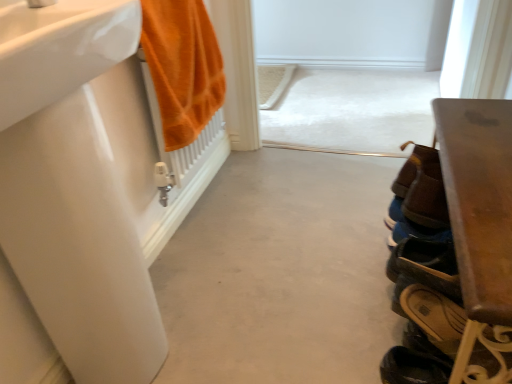
Find the location of a particular element. The image size is (512, 384). white glossy sink at left, acting as the first sink starting from the top is located at coordinates (60, 50).

Describe the element at coordinates (413, 167) in the screenshot. I see `brown leather shoe at lower right, marked as the second shoe in a front-to-back arrangement` at that location.

What is the approximate height of brown leather shoe at lower right, which is counted as the 2th footwear, starting from the bottom?

The height of brown leather shoe at lower right, which is counted as the 2th footwear, starting from the bottom, is 3.88 inches.

What do you see at coordinates (73, 190) in the screenshot? This screenshot has height=384, width=512. I see `white glossy sink at left, the second sink when ordered from top to bottom` at bounding box center [73, 190].

In order to face white glossy sink at left, the second sink when ordered from top to bottom, should I rotate leftwards or rightwards?

Rotate left and turn 21.168 degrees.

Measure the distance between point (453, 303) and camera.

Point (453, 303) is 33.66 inches away from camera.

The height and width of the screenshot is (384, 512). In order to click on beige leather sandals at lower right, positioned as the second footwear in top-to-bottom order in this screenshot , I will do `click(458, 335)`.

Locate an element on the screen. This screenshot has height=384, width=512. white glossy sink at left, acting as the first sink starting from the top is located at coordinates (60, 50).

Considering the sizes of beige leather sandals at lower right, positioned as the second footwear in top-to-bottom order, and gray matte concrete at center in the image, is beige leather sandals at lower right, positioned as the second footwear in top-to-bottom order, taller or shorter than gray matte concrete at center?

Considering their sizes, beige leather sandals at lower right, positioned as the second footwear in top-to-bottom order, has more height than gray matte concrete at center.

Is beige leather sandals at lower right, positioned as the second footwear in top-to-bottom order, located outside gray matte concrete at center?

beige leather sandals at lower right, positioned as the second footwear in top-to-bottom order, is positioned outside gray matte concrete at center.

Which of these two, beige leather sandals at lower right, placed as the 1th footwear when sorted from bottom to top, or gray matte concrete at center, is bigger?

gray matte concrete at center.

Which object is wider, gray matte concrete at center or beige leather sandals at lower right, placed as the 1th footwear when sorted from bottom to top?

With larger width is gray matte concrete at center.

From the picture: Is gray matte concrete at center surrounding beige leather sandals at lower right, positioned as the second footwear in top-to-bottom order?

No, beige leather sandals at lower right, positioned as the second footwear in top-to-bottom order, is not inside gray matte concrete at center.

Does gray matte concrete at center appear on the right side of beige leather sandals at lower right, positioned as the second footwear in top-to-bottom order?

No.

From the image's perspective, is gray matte concrete at center on beige leather sandals at lower right, placed as the 1th footwear when sorted from bottom to top?

Yes.

From a real-world perspective, is orange cotton towel at left positioned over brown leather shoe at lower right, marked as the second shoe in a front-to-back arrangement, based on gravity?

Yes, from a real-world perspective, orange cotton towel at left is above brown leather shoe at lower right, marked as the second shoe in a front-to-back arrangement.

Where is `the 1st shoe below the orange cotton towel at left (from the image's perspective)`? Image resolution: width=512 pixels, height=384 pixels. the 1st shoe below the orange cotton towel at left (from the image's perspective) is located at coordinates (413, 167).

Is brown leather shoe at lower right, the first shoe positioned from the back, located within orange cotton towel at left?

No.

Considering the relative positions of orange cotton towel at left and brown leather shoe at lower right, the first shoe positioned from the back, in the image provided, is orange cotton towel at left to the left of brown leather shoe at lower right, the first shoe positioned from the back, from the viewer's perspective?

Yes, orange cotton towel at left is to the left of brown leather shoe at lower right, the first shoe positioned from the back.

Choose the correct answer: Is beige leather sandals at lower right, positioned as the second footwear in top-to-bottom order, inside brown leather shoe at lower right, which is counted as the 2th footwear, starting from the bottom, or outside it?

The correct answer is: outside.

Based on their sizes in the image, would you say beige leather sandals at lower right, positioned as the second footwear in top-to-bottom order, is bigger or smaller than brown leather shoe at lower right, which is counted as the 2th footwear, starting from the bottom?

In the image, beige leather sandals at lower right, positioned as the second footwear in top-to-bottom order, appears to be smaller than brown leather shoe at lower right, which is counted as the 2th footwear, starting from the bottom.

In the scene shown: From the image's perspective, does beige leather sandals at lower right, placed as the 1th footwear when sorted from bottom to top, appear lower than brown leather shoe at lower right, the first footwear positioned from the top?

Yes, from the image's perspective, beige leather sandals at lower right, placed as the 1th footwear when sorted from bottom to top, is below brown leather shoe at lower right, the first footwear positioned from the top.

Between gray matte concrete at center and brown leather shoe at lower right, marked as the second shoe in a front-to-back arrangement, which one has smaller size?

With smaller size is brown leather shoe at lower right, marked as the second shoe in a front-to-back arrangement.

Is gray matte concrete at center aimed at brown leather shoe at lower right, marked as the second shoe in a front-to-back arrangement?

No, gray matte concrete at center does not turn towards brown leather shoe at lower right, marked as the second shoe in a front-to-back arrangement.

Considering the sizes of objects gray matte concrete at center and brown leather shoe at lower right, the first shoe positioned from the back, in the image provided, who is taller, gray matte concrete at center or brown leather shoe at lower right, the first shoe positioned from the back,?

Standing taller between the two is brown leather shoe at lower right, the first shoe positioned from the back.

Does gray matte concrete at center come in front of brown leather shoe at lower right, the first shoe positioned from the back?

That is True.

Considering the sizes of brown wooden bench at right and brown leather shoe at lower right, which is counted as the 2th footwear, starting from the bottom, in the image, is brown wooden bench at right wider or thinner than brown leather shoe at lower right, which is counted as the 2th footwear, starting from the bottom,?

brown wooden bench at right is wider than brown leather shoe at lower right, which is counted as the 2th footwear, starting from the bottom.

How different are the orientations of brown wooden bench at right and brown leather shoe at lower right, which is counted as the 2th footwear, starting from the bottom, in degrees?

The angular difference between brown wooden bench at right and brown leather shoe at lower right, which is counted as the 2th footwear, starting from the bottom, is 0.0043 degrees.

Is brown wooden bench at right not within brown leather shoe at lower right, which is counted as the 2th footwear, starting from the bottom?

Yes, brown wooden bench at right is outside of brown leather shoe at lower right, which is counted as the 2th footwear, starting from the bottom.

Can you tell me how much brown leather shoe at lower right, the 2th shoe when ordered from back to front, and gray matte concrete at center differ in facing direction?

The angle between the facing direction of brown leather shoe at lower right, the 2th shoe when ordered from back to front, and the facing direction of gray matte concrete at center is 88.3 degrees.

Considering the sizes of brown leather shoe at lower right, the 2th shoe when ordered from back to front, and gray matte concrete at center in the image, is brown leather shoe at lower right, the 2th shoe when ordered from back to front, taller or shorter than gray matte concrete at center?

Considering their sizes, brown leather shoe at lower right, the 2th shoe when ordered from back to front, has more height than gray matte concrete at center.

From the image's perspective, count 1st shoes upward from the gray matte concrete at center and point to it. Please provide its 2D coordinates.

[(426, 198)]

Is brown leather shoe at lower right, the first shoe viewed from the front, positioned with its back to gray matte concrete at center?

No, brown leather shoe at lower right, the first shoe viewed from the front,'s orientation is not away from gray matte concrete at center.

You are a GUI agent. You are given a task and a screenshot of the screen. Output one action in this format:
    pyautogui.click(x=<x>, y=<y>)
    Task: Click on the concrete that is under the beige leather sandals at lower right, positioned as the second footwear in top-to-bottom order (from a real-world perspective)
    The height and width of the screenshot is (384, 512).
    Given the screenshot: What is the action you would take?
    pyautogui.click(x=281, y=273)

I want to click on concrete above the beige leather sandals at lower right, positioned as the second footwear in top-to-bottom order (from the image's perspective), so click(x=281, y=273).

Looking at this image, when comparing their distances from brown leather shoe at lower right, the first shoe positioned from the back, does brown leather shoe at lower right, the first shoe viewed from the front, or brown leather shoe at lower right, which is counted as the 2th footwear, starting from the bottom, seem further?

brown leather shoe at lower right, which is counted as the 2th footwear, starting from the bottom, is positioned further to the anchor brown leather shoe at lower right, the first shoe positioned from the back.

Considering their positions, is brown leather shoe at lower right, the first shoe viewed from the front, positioned further to brown leather shoe at lower right, the first shoe positioned from the back, than beige leather sandals at lower right, placed as the 1th footwear when sorted from bottom to top?

beige leather sandals at lower right, placed as the 1th footwear when sorted from bottom to top, is further to brown leather shoe at lower right, the first shoe positioned from the back.

Looking at the image, which one is located closer to brown leather shoe at lower right, the first shoe positioned from the back, orange cotton towel at left or brown leather shoe at lower right, the first footwear positioned from the top?

Based on the image, brown leather shoe at lower right, the first footwear positioned from the top, appears to be nearer to brown leather shoe at lower right, the first shoe positioned from the back.

Based on their spatial positions, is white glossy sink at left, the second sink positioned from the bottom, or brown wooden bench at right further from brown leather shoe at lower right, the 2th shoe when ordered from back to front?

white glossy sink at left, the second sink positioned from the bottom, lies further to brown leather shoe at lower right, the 2th shoe when ordered from back to front, than the other object.

Looking at the image, which one is located further to brown leather shoe at lower right, the first shoe positioned from the back, brown wooden bench at right or orange cotton towel at left?

Among the two, orange cotton towel at left is located further to brown leather shoe at lower right, the first shoe positioned from the back.

Based on their spatial positions, is white glossy sink at left, the second sink positioned from the bottom, or brown wooden bench at right closer to orange cotton towel at left?

The object closer to orange cotton towel at left is white glossy sink at left, the second sink positioned from the bottom.

When comparing their distances from gray matte concrete at center, does brown leather shoe at lower right, the first shoe viewed from the front, or brown leather shoe at lower right, the first footwear positioned from the top, seem further?

brown leather shoe at lower right, the first shoe viewed from the front.

Based on their spatial positions, is orange cotton towel at left or gray matte concrete at center further from brown wooden bench at right?

orange cotton towel at left is further to brown wooden bench at right.

Find the location of a particular element. sink between white glossy sink at left, the second sink positioned from the bottom, and brown wooden bench at right is located at coordinates (73, 190).

Locate an element on the screen. This screenshot has height=384, width=512. concrete located between brown wooden bench at right and brown leather shoe at lower right, the first shoe positioned from the back, in the depth direction is located at coordinates (281, 273).

Where is `concrete between white glossy sink at left, which is counted as the 1th sink, starting from the bottom, and beige leather sandals at lower right, placed as the 1th footwear when sorted from bottom to top`? Image resolution: width=512 pixels, height=384 pixels. concrete between white glossy sink at left, which is counted as the 1th sink, starting from the bottom, and beige leather sandals at lower right, placed as the 1th footwear when sorted from bottom to top is located at coordinates (281, 273).

Locate an element on the screen. The height and width of the screenshot is (384, 512). footwear between gray matte concrete at center and beige leather sandals at lower right, positioned as the second footwear in top-to-bottom order is located at coordinates (426, 266).